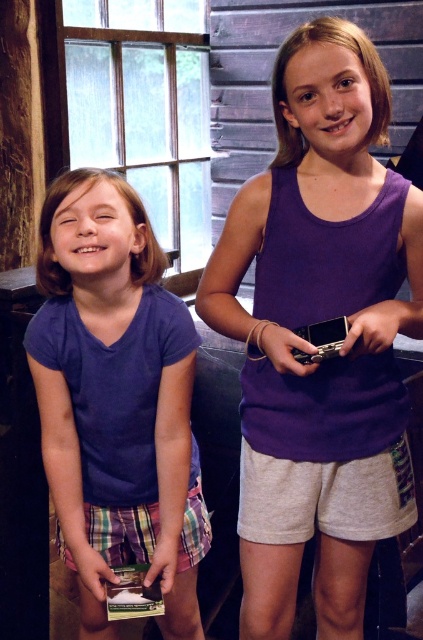
You are planning to buy a purple top for a casual day out. You want to choose the one that is bigger in size. Which one should you pick between the purple matte tank top at center and the purple cotton shirt at left?

The purple matte tank top at center has a larger size compared to the purple cotton shirt at left, so you should pick the purple matte tank top at center.

You are standing in the rustic indoor setting and want to place a new decorative item between the two points marked as point (398, 490) and point (71, 298). Which point should the decorative item be closer to in order to maintain visual balance?

The decorative item should be placed closer to point (71, 298) because point (398, 490) is closer to the viewer, making it visually heavier. To balance the composition, the item should be nearer to the point that is farther away.